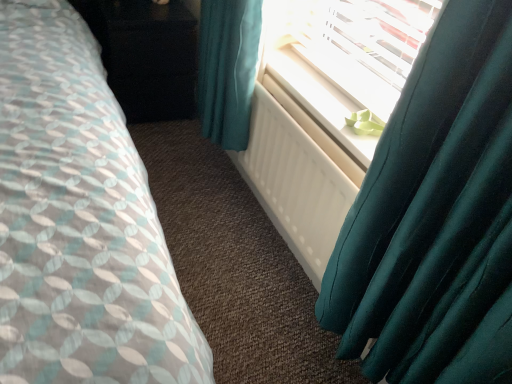
Question: In the image, is white plastic radiator at upper center on the left side or the right side of teal satin curtain at right?

Choices:
 (A) right
 (B) left

Answer: (B)

Question: From a real-world perspective, relative to teal satin curtain at right, is white plastic radiator at upper center vertically above or below?

Choices:
 (A) below
 (B) above

Answer: (A)

Question: Estimate the real-world distances between objects in this image. Which object is farther from the black glossy dresser at upper left?

Choices:
 (A) white matte radiator at center
 (B) teal satin curtain at right
 (C) white plastic radiator at upper center

Answer: (B)

Question: Estimate the real-world distances between objects in this image. Which object is closer to the black glossy dresser at upper left?

Choices:
 (A) teal satin curtain at right
 (B) white matte radiator at center
 (C) white plastic radiator at upper center

Answer: (C)